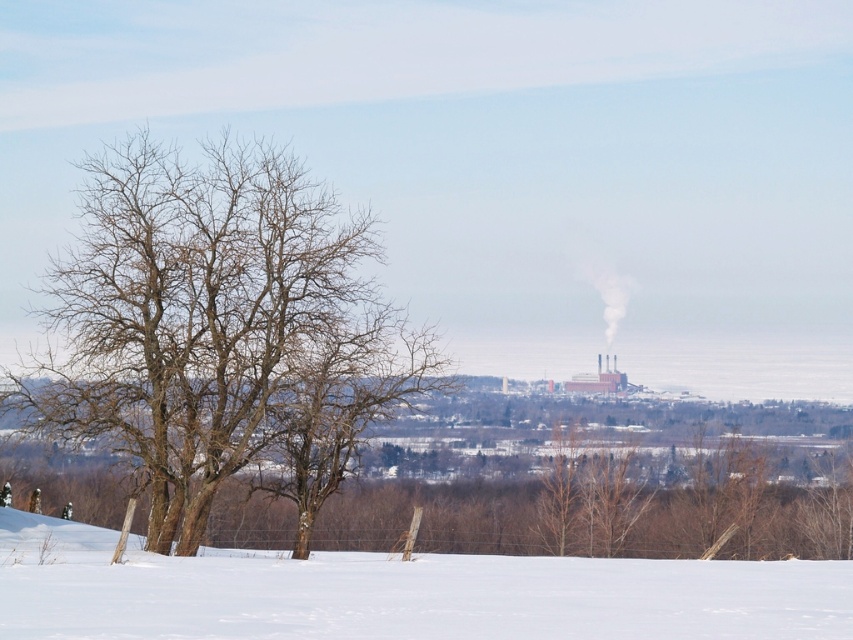
Looking at this image, you are standing at the origin point in the winter landscape. Which direction should you walk to reach the bare wood tree at left?

The bare wood tree at left is located at coordinates point (x=206, y=314), so you should walk towards the left side of the scene to reach it.

You are an observer looking at the winter scene. You notice a bare wood tree at left and white snow at lower center. Which object has a smaller width?

The bare wood tree at left is thinner than the white snow at lower center, so the bare wood tree at left has a smaller width.

You are standing in the winter landscape and notice two points marked on the snow. The first is at coordinates point [184,552] and the second at point [228,550]. Which point is closer to you?

Point [184,552] is in front of point [228,550], so it is closer to you.